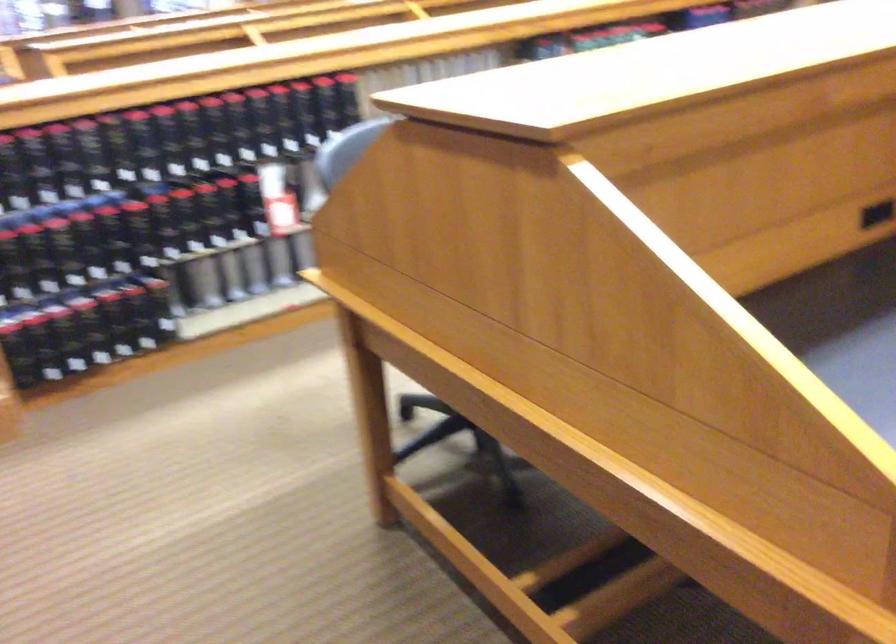
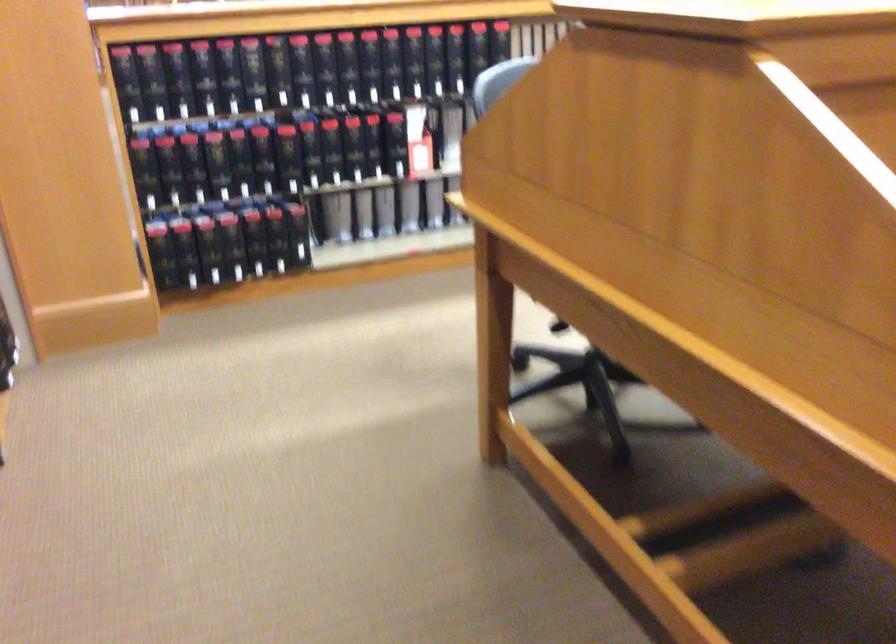
Where in the second image is the point corresponding to (x=130, y=140) from the first image?

(291, 71)